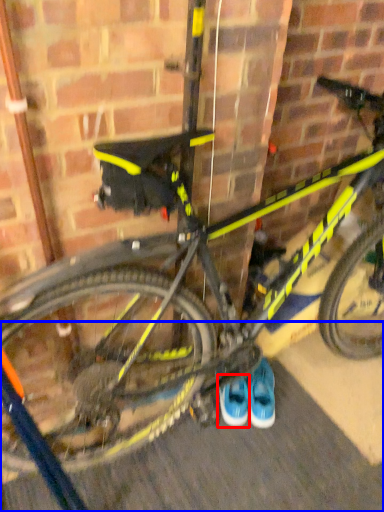
Question: Which of the following is the closest to the observer, footwear (highlighted by a red box) or pavement (highlighted by a blue box)?

Choices:
 (A) footwear
 (B) pavement

Answer: (B)